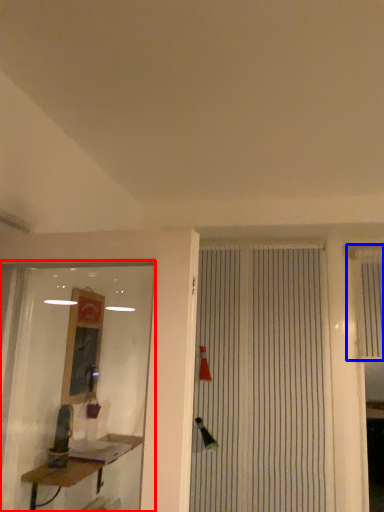
Question: Which of the following is the closest to the observer, shop window (highlighted by a red box) or shutter (highlighted by a blue box)?

Choices:
 (A) shop window
 (B) shutter

Answer: (A)